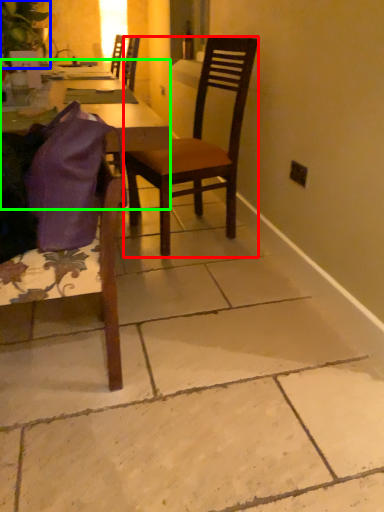
Question: Based on their relative distances, which object is nearer to chair (highlighted by a red box)? Choose from houseplant (highlighted by a blue box) and desk (highlighted by a green box).

Choices:
 (A) houseplant
 (B) desk

Answer: (B)